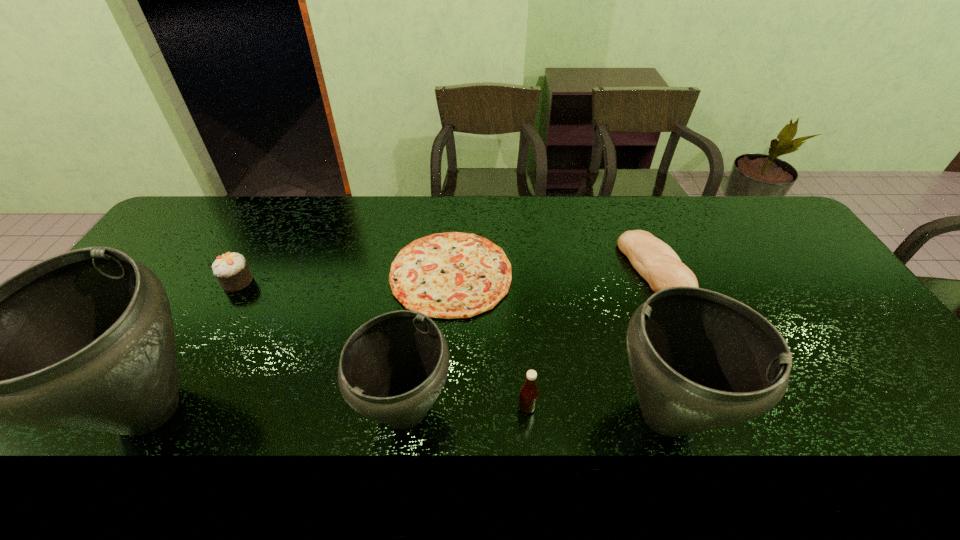
Where is `empty space between the rightmost urn and the cupcake`? This screenshot has height=540, width=960. empty space between the rightmost urn and the cupcake is located at coordinates (452, 348).

Find the location of `free space between the cupcake and the second tallest object`. free space between the cupcake and the second tallest object is located at coordinates (452, 348).

Where is `free spot between the pizza and the rightmost urn`? This screenshot has width=960, height=540. free spot between the pizza and the rightmost urn is located at coordinates (559, 344).

Select which object appears as the third closest to the second shortest object. Please provide its 2D coordinates. Your answer should be formatted as a tuple, i.e. [(x, y)], where the tuple contains the x and y coordinates of a point satisfying the conditions above.

[(528, 397)]

Identify which object is located as the fifth nearest to the bread. Please provide its 2D coordinates. Your answer should be formatted as a tuple, i.e. [(x, y)], where the tuple contains the x and y coordinates of a point satisfying the conditions above.

[(84, 340)]

This screenshot has height=540, width=960. I want to click on urn identified as the closest to the second shortest object, so click(700, 360).

Image resolution: width=960 pixels, height=540 pixels. Find the location of `urn that is the second closest to the sixth tallest object`. urn that is the second closest to the sixth tallest object is located at coordinates (392, 369).

At what (x,y) coordinates should I click in order to perform the action: click on free spot that satisfies the following two spatial constraints: 1. on the back side of the second shortest object; 2. on the left side of the fourth shortest object. Please return your answer as a coordinate pair (x, y). Looking at the image, I should click on (516, 270).